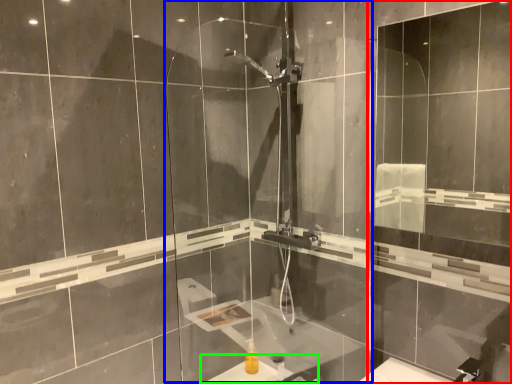
Question: Considering the real-world distances, which object is closest to screen door (highlighted by a red box)? screen door (highlighted by a blue box) or sink (highlighted by a green box).

Choices:
 (A) screen door
 (B) sink

Answer: (A)